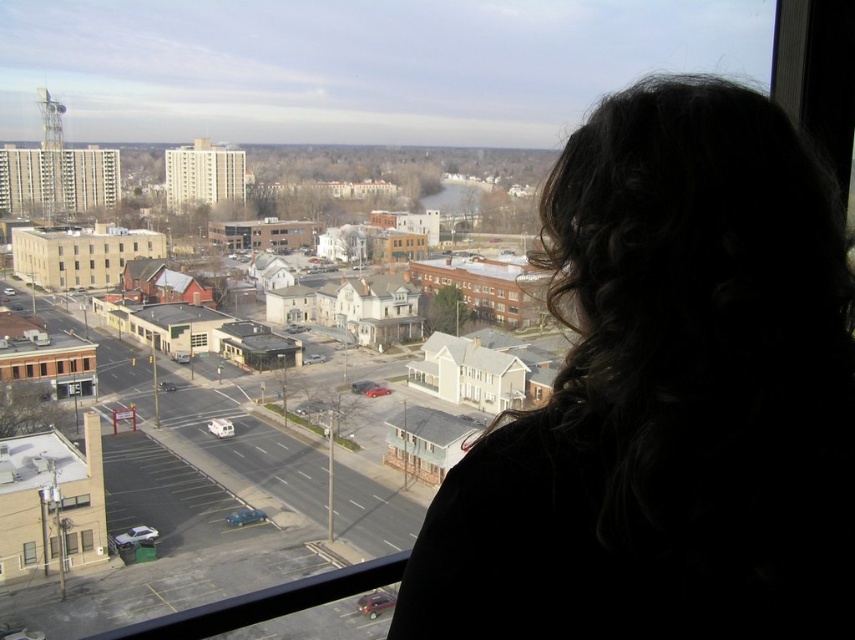
You are standing on a balcony and want to look down through the transparent glass window at lower left to see the street below. However, the dark curly hair at upper right is blocking your view. Which object should you move to get an unobstructed view?

You should move the dark curly hair at upper right, as it is above the transparent glass window at lower left and is blocking your view.

You are standing on a balcony and want to see both the dark curly hair at upper right and the transparent glass window at lower left. Which one is taller?

The dark curly hair at upper right is taller than the transparent glass window at lower left.

You are standing on a balcony and want to take a photo of the town below. There is a person with dark curly hair at upper right in your viewfinder. To avoid their hair from blocking the town, should you adjust your camera upwards or downwards?

The dark curly hair at upper right is located at point (667, 397), which is near the upper part of the frame. To avoid blocking the town below, you should adjust your camera downwards.